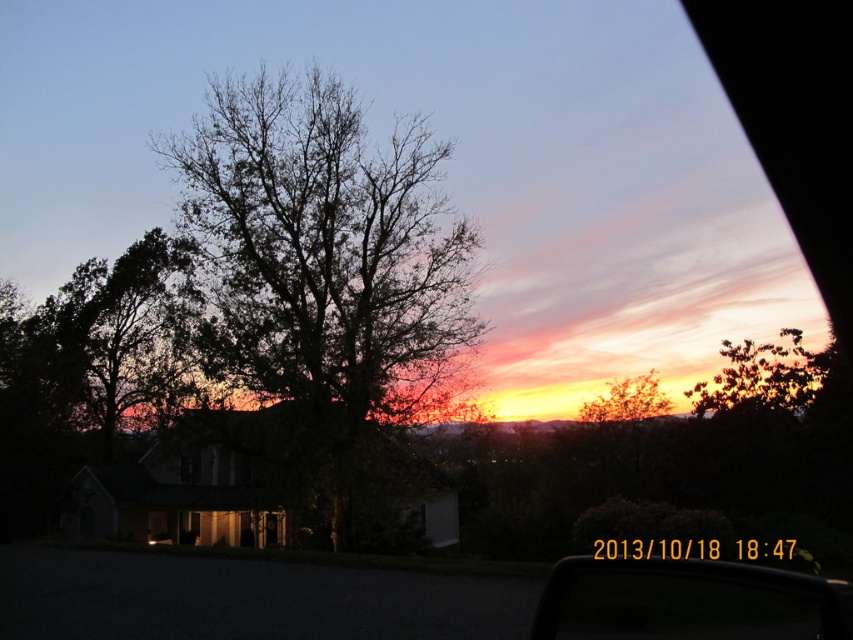
You are sitting in the car and want to identify the tree closest to the car. Which tree is located at point (111, 336)?

The dark green leafy tree at left is located at point (111, 336).

You are inside a car and want to take a photo of the sunset through the transparent glass car window at center and the green leafy tree at upper right. Which object is taller when viewed from your current position inside the car?

The transparent glass car window at center is taller than the green leafy tree at upper right, so the transparent glass car window at center is taller when viewed from your current position inside the car.

You are taking a photo from inside a car and want to ensure the dark green leafy tree at left is centered in the frame. Given its current position at coordinates 0.525 on the x and 0.131 on the y axis, what adjustment should you make to the camera angle to center it?

To center the dark green leafy tree at left, you should adjust the camera angle so that its 2D location reaches the center coordinates of the frame, which is typically at point 0.5 on both the x and y axes. Since the tree is currently at x 0.525 and y 0.131, you need to move the camera slightly to the left to decrease the x coordinate and upwards to increase the y coordinate, bringing both closer to 0.5.